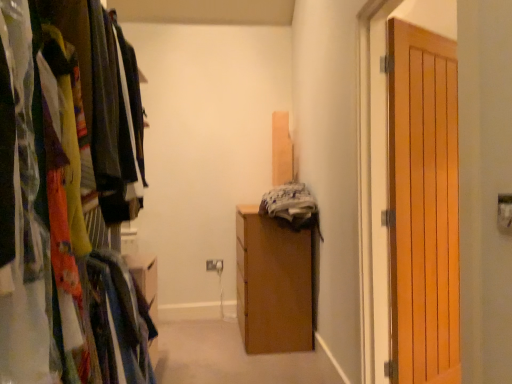
Question: Considering the relative sizes of wooden wardrobe at left and wooden door at right in the image provided, is wooden wardrobe at left bigger than wooden door at right?

Choices:
 (A) no
 (B) yes

Answer: (B)

Question: Does wooden wardrobe at left have a lesser width compared to wooden door at right?

Choices:
 (A) no
 (B) yes

Answer: (A)

Question: Is wooden wardrobe at left smaller than wooden door at right?

Choices:
 (A) yes
 (B) no

Answer: (B)

Question: Would you consider wooden wardrobe at left to be distant from wooden door at right?

Choices:
 (A) no
 (B) yes

Answer: (B)

Question: From the image's perspective, is wooden wardrobe at left over wooden door at right?

Choices:
 (A) no
 (B) yes

Answer: (B)

Question: Does point (39, 331) appear closer or farther from the camera than point (177, 349)?

Choices:
 (A) farther
 (B) closer

Answer: (B)

Question: Relative to wooden cabinet at center, is wooden wardrobe at left in front or behind?

Choices:
 (A) behind
 (B) front

Answer: (B)

Question: Based on their positions, is wooden wardrobe at left located to the left or right of wooden cabinet at center?

Choices:
 (A) left
 (B) right

Answer: (A)

Question: Considering the positions of wooden wardrobe at left and wooden cabinet at center in the image, is wooden wardrobe at left wider or thinner than wooden cabinet at center?

Choices:
 (A) thin
 (B) wide

Answer: (A)

Question: From the image's perspective, relative to wooden wardrobe at left, is wooden door at right above or below?

Choices:
 (A) above
 (B) below

Answer: (B)

Question: Considering the positions of wooden door at right and wooden wardrobe at left in the image, is wooden door at right taller or shorter than wooden wardrobe at left?

Choices:
 (A) short
 (B) tall

Answer: (A)

Question: Which is correct: wooden door at right is inside wooden wardrobe at left, or outside of it?

Choices:
 (A) inside
 (B) outside

Answer: (B)

Question: From a real-world perspective, relative to wooden wardrobe at left, is wooden door at right vertically above or below?

Choices:
 (A) below
 (B) above

Answer: (A)

Question: From the image's perspective, is wooden door at right located above or below wooden cabinet at center?

Choices:
 (A) above
 (B) below

Answer: (A)

Question: Is point (413, 26) positioned closer to the camera than point (263, 362)?

Choices:
 (A) closer
 (B) farther

Answer: (A)